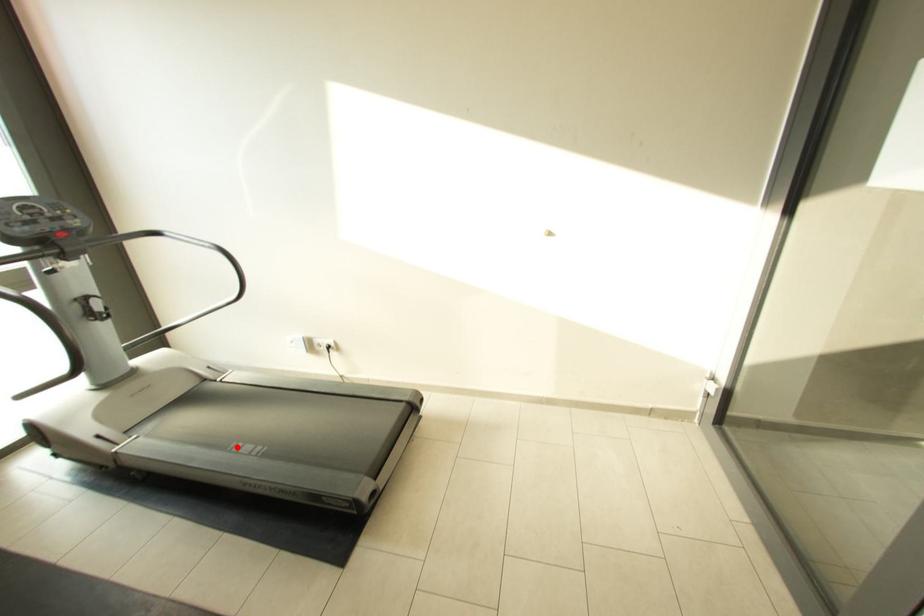
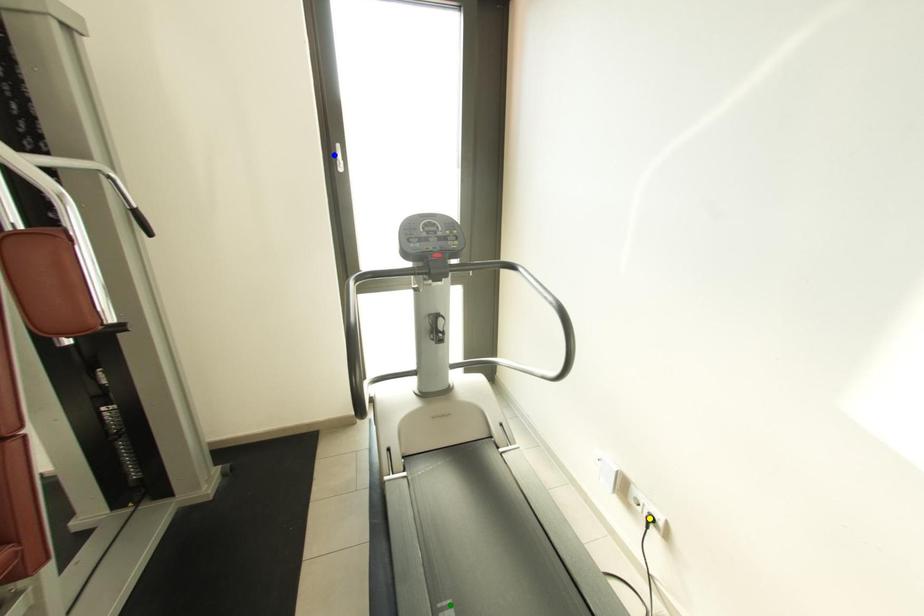
Question: I am providing you with two images of the same scene from different viewpoints. A red point is marked on the first image. You are given multiple points on the second image. Which point in image 2 represents the same 3d spot as the red point in image 1?

Choices:
 (A) yellow point
 (B) green point
 (C) blue point

Answer: (B)